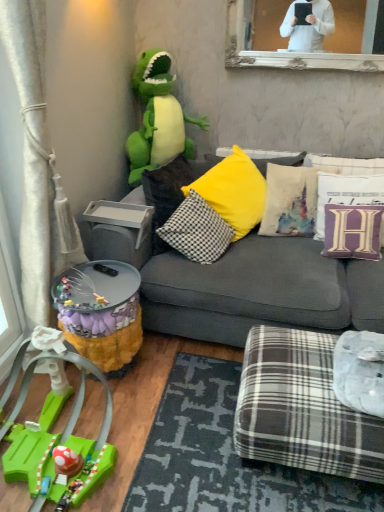
At what (x,y) coordinates should I click in order to perform the action: click on vacant space situated on the left part of plaid fabric ottoman at lower right. Please return your answer as a coordinate pair (x, y). The width and height of the screenshot is (384, 512). Looking at the image, I should click on (190, 418).